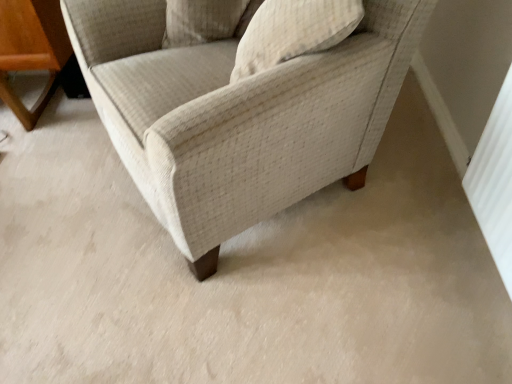
Question: Based on their positions, is textured beige pillow at upper center, the 1th pillow positioned from the right, located to the left or right of beige fabric chair at center?

Choices:
 (A) right
 (B) left

Answer: (A)

Question: Is textured beige pillow at upper center, the 1th pillow positioned from the right, bigger or smaller than beige fabric chair at center?

Choices:
 (A) big
 (B) small

Answer: (B)

Question: Which object is the closest to the textured beige pillow at upper center, which appears as the 2th pillow when viewed from the left?

Choices:
 (A) beige fabric chair at center
 (B) beige textured pillow at upper center, the first pillow viewed from the left

Answer: (A)

Question: Based on their relative distances, which object is farther from the beige textured pillow at upper center, acting as the second pillow starting from the right?

Choices:
 (A) beige fabric chair at center
 (B) textured beige pillow at upper center, which appears as the 2th pillow when viewed from the left

Answer: (A)